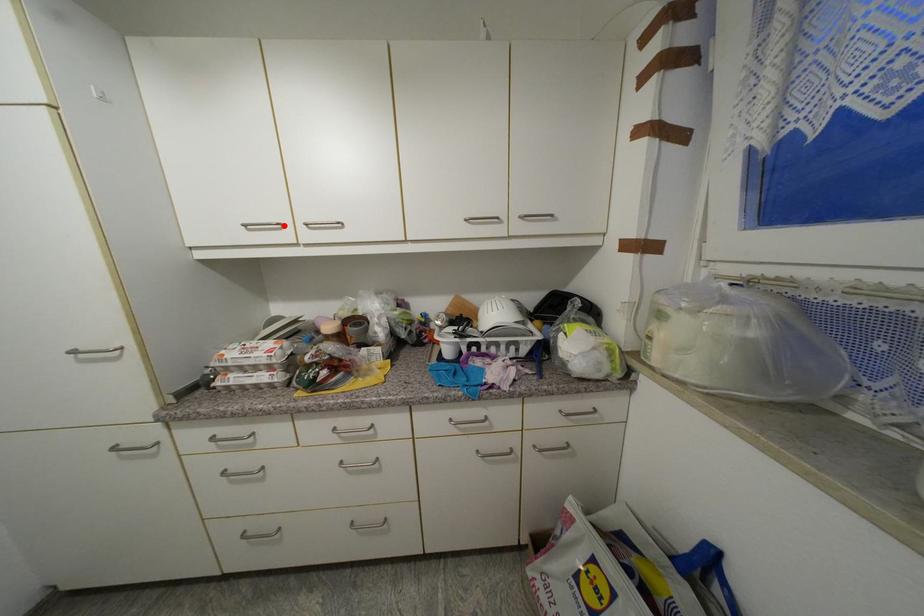
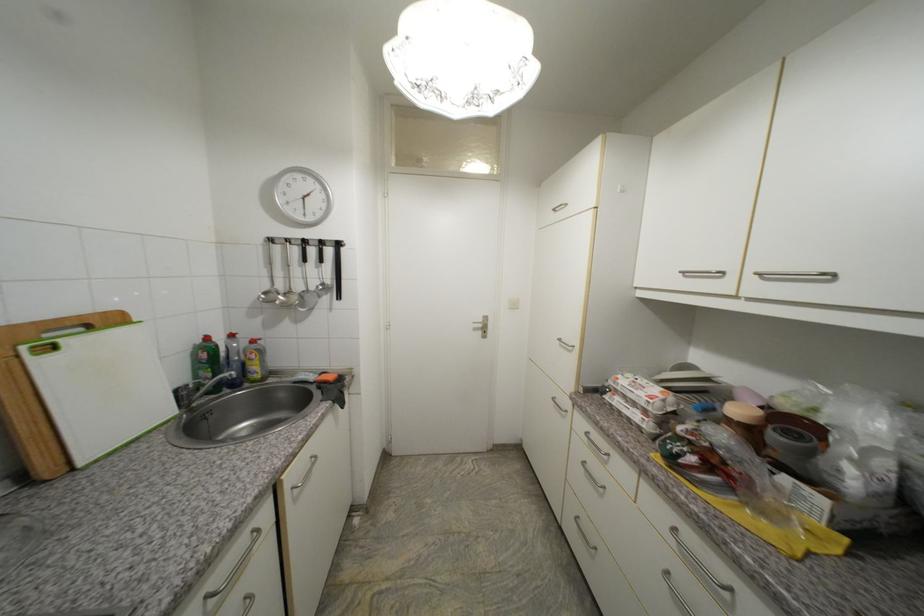
The point at the highlighted location is marked in the first image. Where is the corresponding point in the second image?

(724, 274)